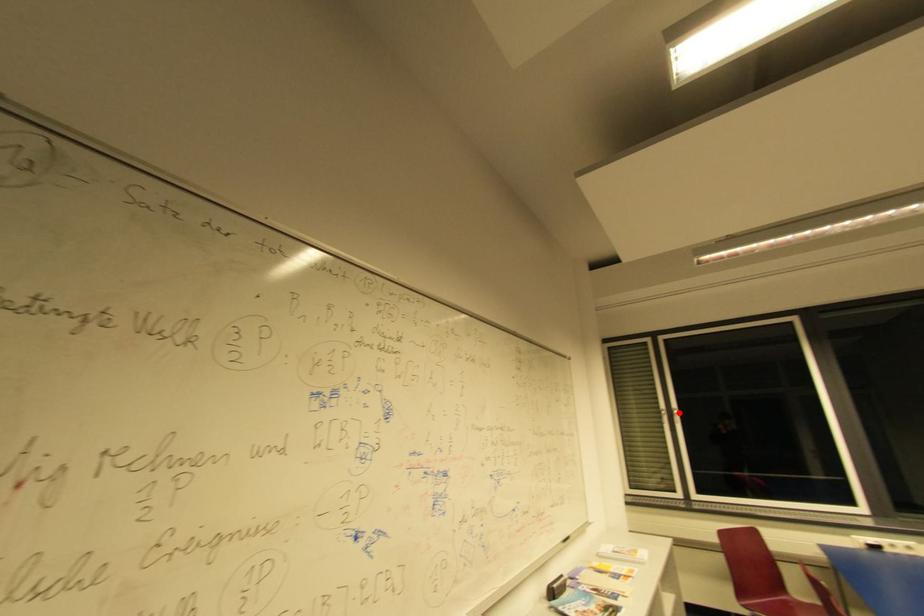
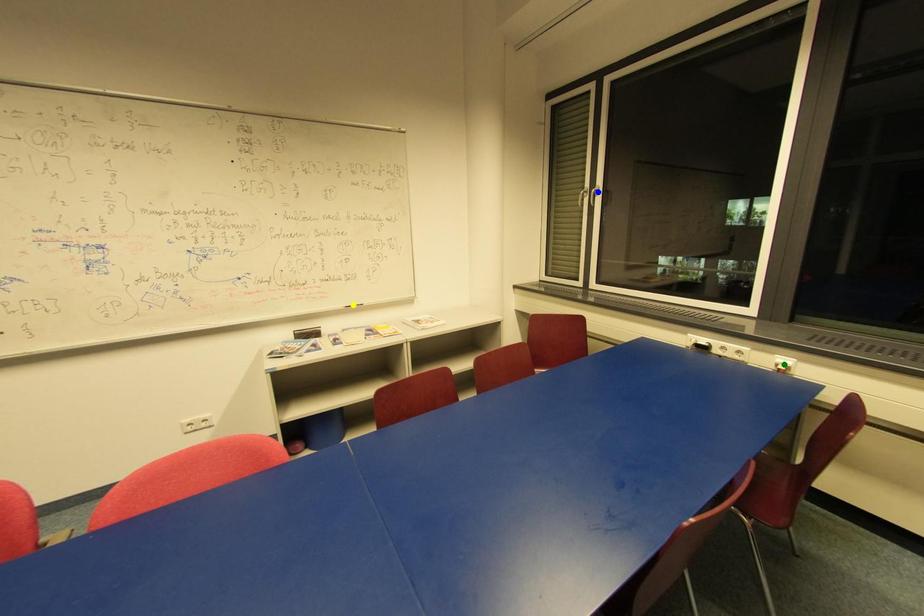
Question: I am providing you with two images of the same scene from different viewpoints. A red point is marked on the first image. You are given multiple points on the second image. Which spot in image 2 lines up with the point in image 1?

Choices:
 (A) green point
 (B) blue point
 (C) yellow point

Answer: (B)